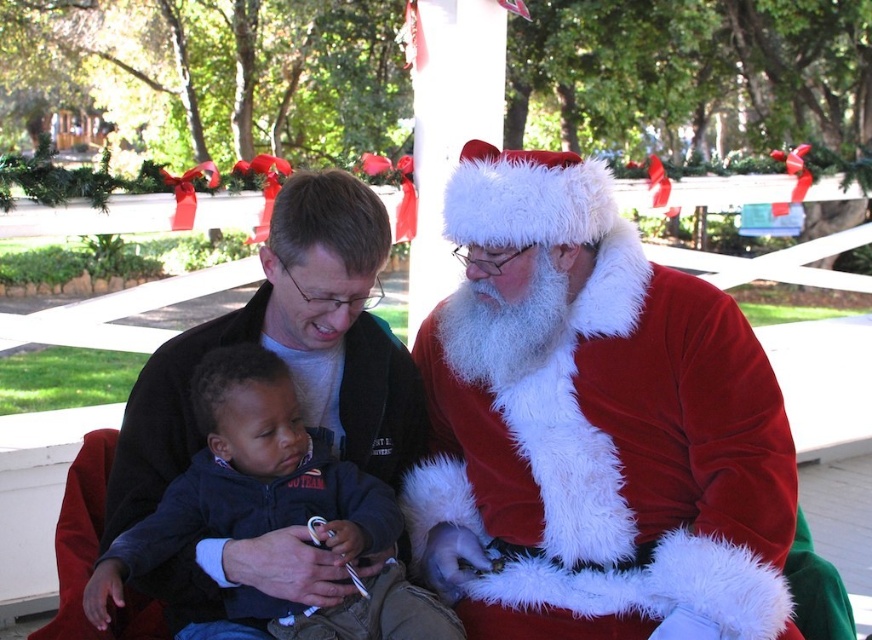
Question: Is velvet santa claus at center thinner than matte black jacket at center?

Choices:
 (A) no
 (B) yes

Answer: (A)

Question: Can you confirm if velvet santa claus at center is wider than matte black jacket at center?

Choices:
 (A) no
 (B) yes

Answer: (B)

Question: Which of the following is the closest to the observer?

Choices:
 (A) (134, 400)
 (B) (713, 344)

Answer: (B)

Question: Does velvet santa claus at center come in front of matte black jacket at center?

Choices:
 (A) yes
 (B) no

Answer: (B)

Question: Which of the following is the closest to the observer?

Choices:
 (A) velvet santa claus at center
 (B) matte black jacket at center

Answer: (B)